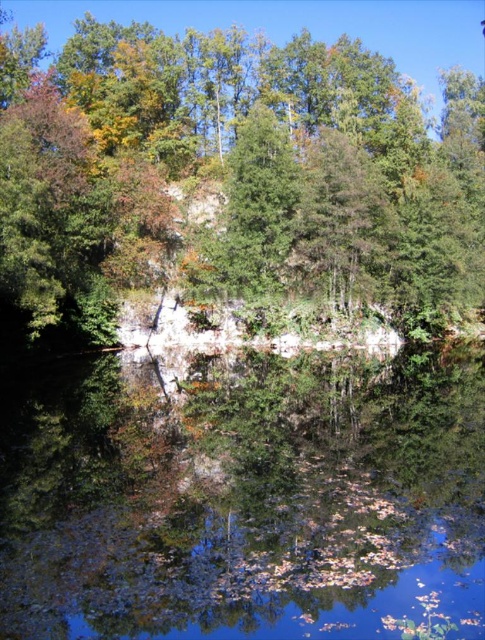
Question: Where is clear water at center located in relation to green matte tree at upper center in the image?

Choices:
 (A) below
 (B) above

Answer: (A)

Question: Is clear water at center thinner than green matte tree at upper center?

Choices:
 (A) no
 (B) yes

Answer: (B)

Question: Can you confirm if clear water at center is positioned below green matte tree at upper center?

Choices:
 (A) no
 (B) yes

Answer: (B)

Question: Which point appears closest to the camera in this image?

Choices:
 (A) [30, 552]
 (B) [319, 193]

Answer: (A)

Question: Which of the following is the closest to the observer?

Choices:
 (A) clear water at center
 (B) green matte tree at upper center

Answer: (A)